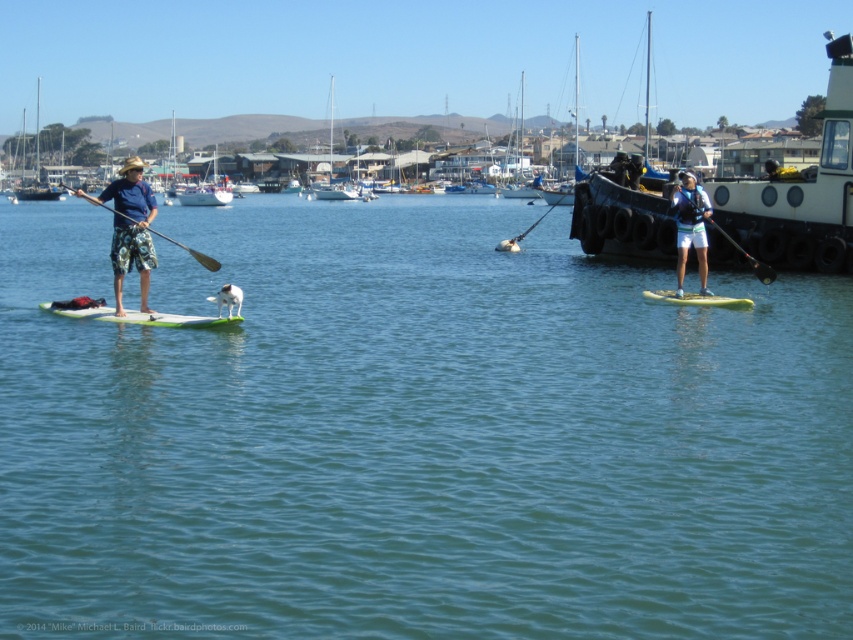
Question: Is white foam board at center bigger than black glossy paddle at right?

Choices:
 (A) yes
 (B) no

Answer: (A)

Question: Which object is the closest to the white plastic sailboat at center?

Choices:
 (A) blue fabric shirt at center
 (B) black glossy paddle at right

Answer: (A)

Question: Can you confirm if white rubber boat at right is positioned above camouflage shorts at left?

Choices:
 (A) yes
 (B) no

Answer: (A)

Question: Which point appears farthest from the camera in this image?

Choices:
 (A) (509, 237)
 (B) (113, 314)
 (C) (759, 273)
 (D) (850, 61)

Answer: (A)

Question: Which object appears closest to the camera in this image?

Choices:
 (A) blue fabric shirt at center
 (B) yellow foam paddleboard at right
 (C) wooden sailboat at upper left

Answer: (B)

Question: Is camouflage shorts at left positioned in front of white foam board at center?

Choices:
 (A) no
 (B) yes

Answer: (A)